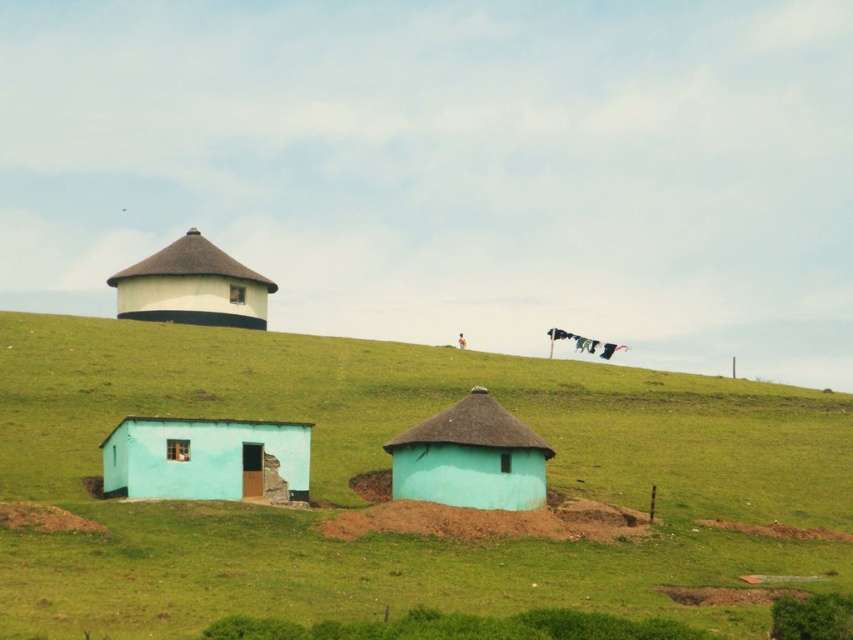
Measure the distance between point [440,452] and camera.

They are 60.48 meters apart.

Does point (392, 458) lie behind point (194, 280)?

No, (392, 458) is in front of (194, 280).

The height and width of the screenshot is (640, 853). Describe the element at coordinates (469, 458) in the screenshot. I see `matte teal thatched hut at center` at that location.

Where is `matte teal thatched hut at center`? This screenshot has height=640, width=853. matte teal thatched hut at center is located at coordinates (469, 458).

Does point (206, 442) come farther from viewer compared to point (444, 497)?

No, it is not.

Which is more to the left, light blue clay hut at lower left or matte teal thatched hut at center?

light blue clay hut at lower left

The image size is (853, 640). Identify the location of light blue clay hut at lower left. (206, 460).

Consider the image. Who is more forward, (329,381) or (483,500)?

Point (483,500)

Consider the image. Does green grassy at lower center come in front of matte teal thatched hut at center?

That is True.

Between point (602, 426) and point (525, 435), which one is positioned behind?

The point (602, 426) is more distant.

Locate an element on the screen. green grassy at lower center is located at coordinates (387, 467).